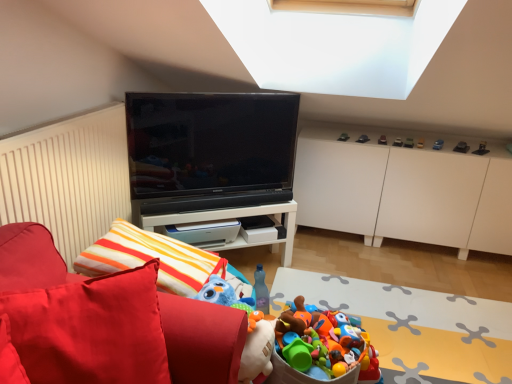
Question: Should I look upward or downward to see metallic car at upper right, positioned as the fifth toy in top-to-bottom order?

Choices:
 (A) down
 (B) up

Answer: (B)

Question: Is metallic gray toy car at upper right, the eighth toy from the top, aimed at black glossy tv at center?

Choices:
 (A) yes
 (B) no

Answer: (B)

Question: Does metallic gray toy car at upper right, the 2th toy viewed from the right, appear on the left side of black glossy tv at center?

Choices:
 (A) yes
 (B) no

Answer: (B)

Question: From the image's perspective, is metallic gray toy car at upper right, the 10th toy positioned from the left, on black glossy tv at center?

Choices:
 (A) no
 (B) yes

Answer: (B)

Question: From a real-world perspective, is metallic gray toy car at upper right, the 10th toy positioned from the left, physically below black glossy tv at center?

Choices:
 (A) yes
 (B) no

Answer: (A)

Question: Is black glossy tv at center a part of metallic gray toy car at upper right, positioned as the 4th toy in bottom-to-top order?

Choices:
 (A) no
 (B) yes

Answer: (A)

Question: From a real-world perspective, does metallic gray toy car at upper right, the 10th toy positioned from the left, stand above black glossy tv at center?

Choices:
 (A) no
 (B) yes

Answer: (A)

Question: Can you confirm if metallic car at upper center, marked as the 8th toy in a right-to-left arrangement, is positioned to the left of metallic car at upper right, positioned as the fifth toy in top-to-bottom order?

Choices:
 (A) no
 (B) yes

Answer: (B)

Question: Can you confirm if metallic car at upper center, which is the second toy from top to bottom, is bigger than metallic car at upper right, positioned as the fifth toy in top-to-bottom order?

Choices:
 (A) yes
 (B) no

Answer: (B)

Question: Can you confirm if metallic car at upper center, which is the 4th toy from left to right, is positioned to the right of metallic car at upper right, the fifth toy viewed from the right?

Choices:
 (A) yes
 (B) no

Answer: (B)

Question: Does metallic car at upper center, marked as the 8th toy in a right-to-left arrangement, contain metallic car at upper right, positioned as the fifth toy in top-to-bottom order?

Choices:
 (A) yes
 (B) no

Answer: (B)

Question: From a real-world perspective, does metallic car at upper center, which is the 4th toy from left to right, stand above metallic car at upper right, the fifth toy viewed from the right?

Choices:
 (A) no
 (B) yes

Answer: (A)

Question: Is metallic car at upper center, which is the second toy from top to bottom, placed right next to metallic car at upper right, the fifth toy viewed from the right?

Choices:
 (A) no
 (B) yes

Answer: (A)

Question: Is metallic red car at upper right, placed as the sixth toy when sorted from left to right, oriented towards metallic car at upper right, the seventh toy in the bottom-to-top sequence?

Choices:
 (A) no
 (B) yes

Answer: (A)